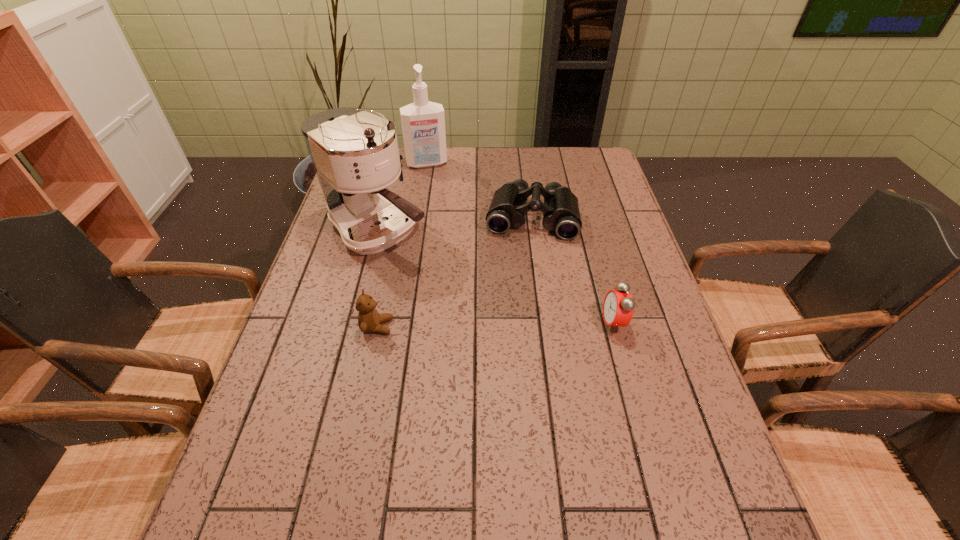
This screenshot has width=960, height=540. Identify the location of vacant space on the desktop that is between the teddy bear and the alarm clock and is positioned on the front label of the farthest object. (470, 325).

Identify the location of vacant space on the desktop that is between the teddy bear and the alarm clock and is positioned on the front-facing side of the coffee maker. The width and height of the screenshot is (960, 540). (511, 325).

Locate an element on the screen. This screenshot has width=960, height=540. vacant spot on the desktop that is between the teddy bear and the alarm clock and is positioned on the front-facing side of the binoculars is located at coordinates (520, 325).